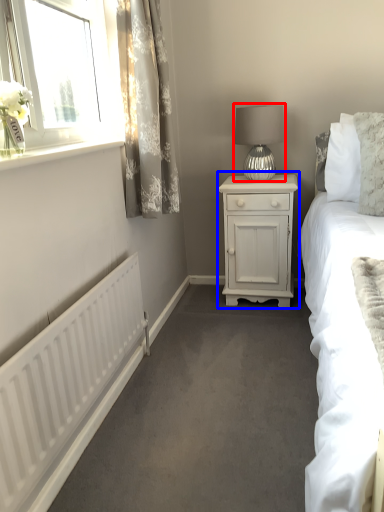
Question: Among these objects, which one is nearest to the camera, table lamp (highlighted by a red box) or nightstand (highlighted by a blue box)?

Choices:
 (A) table lamp
 (B) nightstand

Answer: (A)